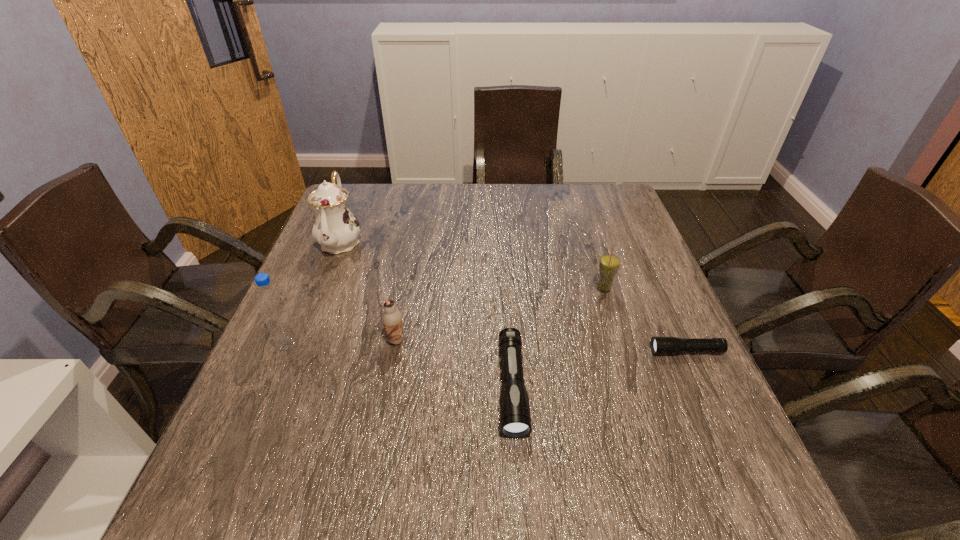
The width and height of the screenshot is (960, 540). Find the location of `vacant point located between the fifth nearest object and the farthest object`. vacant point located between the fifth nearest object and the farthest object is located at coordinates (472, 265).

You are a GUI agent. You are given a task and a screenshot of the screen. Output one action in this format:
    pyautogui.click(x=<x>, y=<y>)
    Task: Click on the vacant space that is in between the farthest object and the shortest object
    
    Given the screenshot: What is the action you would take?
    pyautogui.click(x=514, y=296)

You are a GUI agent. You are given a task and a screenshot of the screen. Output one action in this format:
    pyautogui.click(x=<x>, y=<y>)
    Task: Click on the vacant point located between the water bottle and the farthest object
    The image size is (960, 540).
    Given the screenshot: What is the action you would take?
    pyautogui.click(x=315, y=293)

Where is `free space between the fourth object from right to left and the chinaware`? This screenshot has width=960, height=540. free space between the fourth object from right to left and the chinaware is located at coordinates (368, 291).

This screenshot has height=540, width=960. What are the coordinates of `free space between the fifth nearest object and the shortest object` in the screenshot? It's located at (645, 320).

The width and height of the screenshot is (960, 540). I want to click on empty location between the taller flashlight and the chinaware, so click(x=426, y=314).

Locate an element on the screen. The height and width of the screenshot is (540, 960). free space between the rightmost object and the third object from left to right is located at coordinates (540, 346).

The width and height of the screenshot is (960, 540). Identify the location of free spot between the water bottle and the third object from left to right. (343, 342).

The width and height of the screenshot is (960, 540). What are the coordinates of `vacant area that lies between the water bottle and the second shortest object` in the screenshot? It's located at (400, 365).

I want to click on vacant space that's between the second farthest object and the water bottle, so [x=446, y=316].